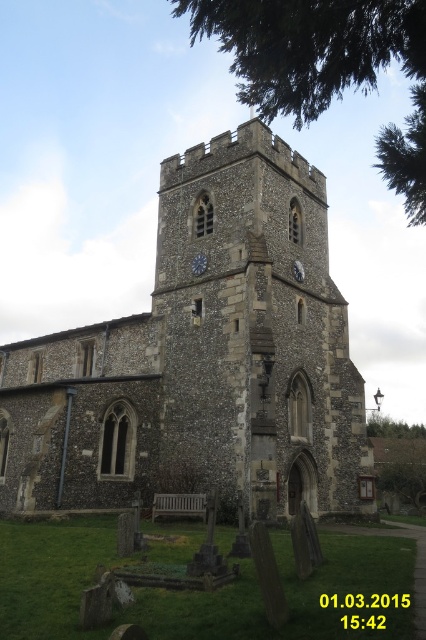
You are planning to take a photo of the stone church at center and the green leafy tree at right from a distance. Based on their sizes in the image, which one would appear larger in the photo?

The stone church at center might be wider than green leafy tree at right, so it would likely appear larger in the photo.

You are standing at the base of the historic stone church tower and want to take a photo of the green leafy tree at upper center. The camera you have can focus on objects up to 30 meters away. Will the tree be in focus?

The green leafy tree at upper center is 33.36 meters from viewer, which is beyond the camera focus range of 30 meters. The tree will not be in focus.